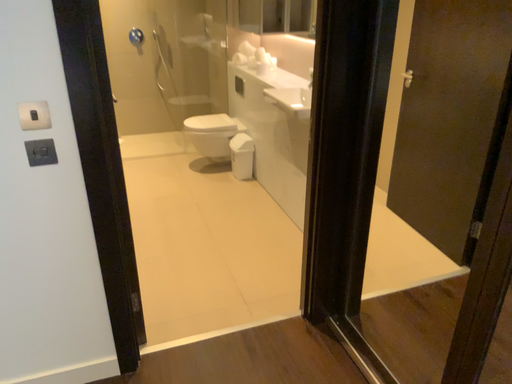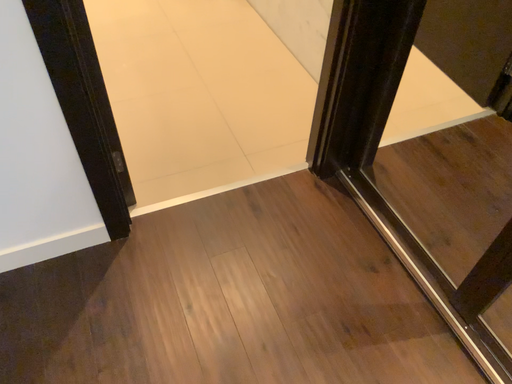
Question: How did the camera likely rotate when shooting the video?

Choices:
 (A) rotated downward
 (B) rotated upward

Answer: (A)